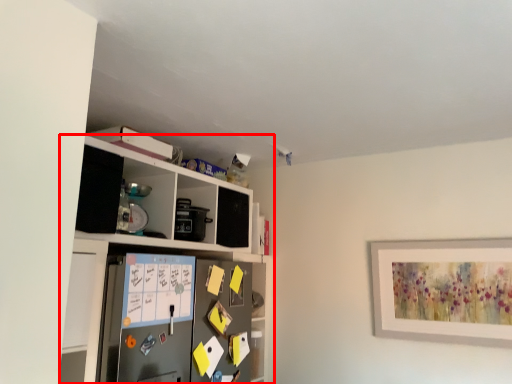
Question: Observing the image, what is the correct spatial positioning of shelf (annotated by the red box) in reference to appliance?

Choices:
 (A) left
 (B) right

Answer: (A)